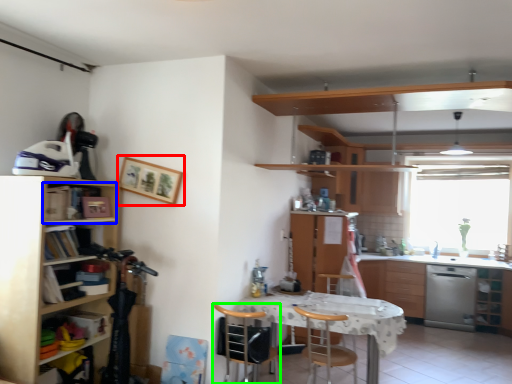
Question: Which object is the farthest from picture frame (highlighted by a red box)? Choose among these: cabinet (highlighted by a blue box) or chair (highlighted by a green box).

Choices:
 (A) cabinet
 (B) chair

Answer: (B)